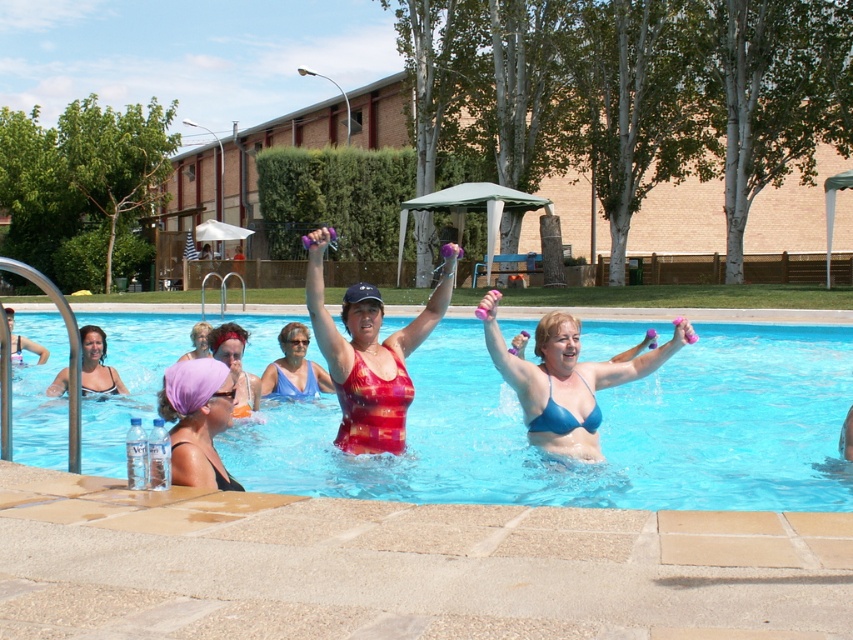
Question: Which point is closer to the camera?

Choices:
 (A) (492, 372)
 (B) (409, 396)
 (C) (238, 401)
 (D) (289, 324)

Answer: (B)

Question: Which is farther from the red textured swimsuit at center?

Choices:
 (A) purple fabric headscarf at upper left
 (B) matte black swimsuit at upper left
 (C) purple fabric headscarf at center

Answer: (B)

Question: Which point is farther to the camera?

Choices:
 (A) blue glossy water at center
 (B) matte black swimsuit at upper left
 (C) transparent plastic goggles at upper center
 (D) blue textured swimsuit at center

Answer: (B)

Question: Does blue textured swimsuit at center lie in front of matte black swimsuit at upper left?

Choices:
 (A) yes
 (B) no

Answer: (A)

Question: Can you confirm if blue textured swimsuit at center is positioned to the left of purple fabric headscarf at center?

Choices:
 (A) yes
 (B) no

Answer: (B)

Question: Does purple fabric headscarf at upper left lie in front of matte black swimsuit at upper left?

Choices:
 (A) yes
 (B) no

Answer: (A)